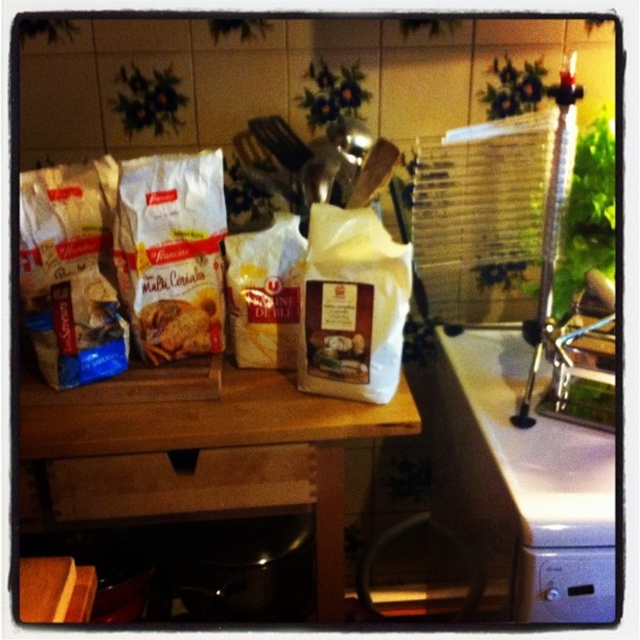
Question: Does wooden table at center have a larger size compared to matte brown bagel at center?

Choices:
 (A) no
 (B) yes

Answer: (B)

Question: Is white matte cookie mix at center wider than white matte bag of flour at center?

Choices:
 (A) no
 (B) yes

Answer: (B)

Question: Which object is positioned farthest from the wooden table at center?

Choices:
 (A) white glossy countertop at lower right
 (B) matte brown bagel at center
 (C) white matte sack at center
 (D) white matte cookie mix at center

Answer: (A)

Question: Based on their relative distances, which object is nearer to the white matte cookie mix at center?

Choices:
 (A) wooden table at center
 (B) matte brown bagel at center
 (C) white matte sack at center

Answer: (B)

Question: Does wooden table at center appear on the left side of white matte cookie mix at center?

Choices:
 (A) no
 (B) yes

Answer: (A)

Question: Which is farther from the wooden table at center?

Choices:
 (A) white glossy countertop at lower right
 (B) matte brown bagel at center
 (C) white matte cookie mix at center

Answer: (A)